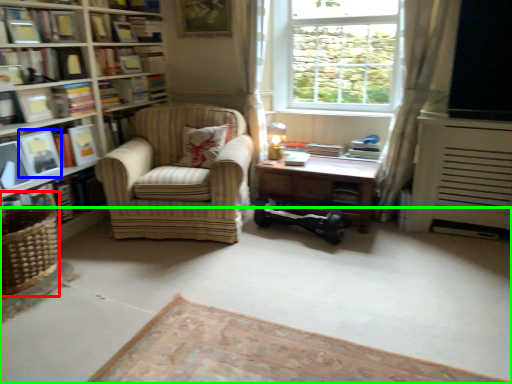
Question: Based on their relative distances, which object is farther from basket (highlighted by a red box)? Choose from paperback book (highlighted by a blue box) and plain (highlighted by a green box).

Choices:
 (A) paperback book
 (B) plain

Answer: (B)